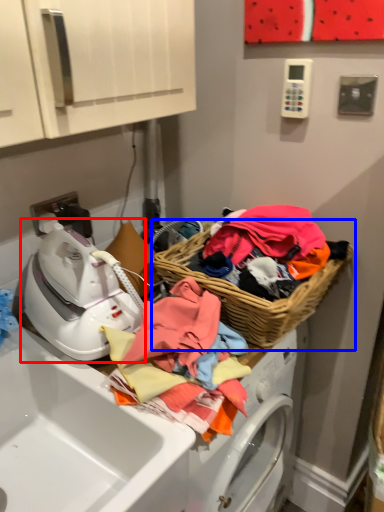
Question: Which object is further to the camera taking this photo, washer (highlighted by a red box) or picnic basket (highlighted by a blue box)?

Choices:
 (A) washer
 (B) picnic basket

Answer: (B)